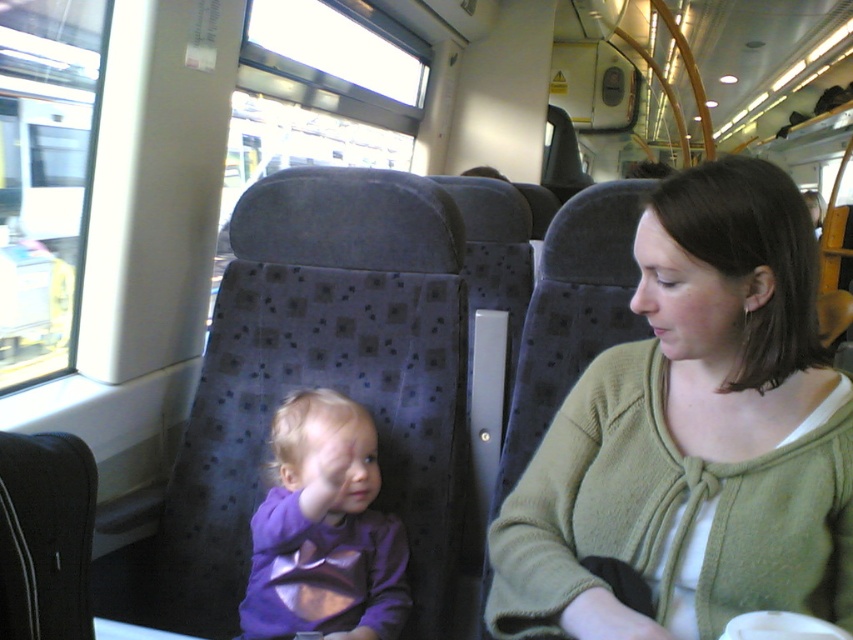
Is point (695, 506) farther from camera compared to point (306, 525)?

No, it is not.

Does point (714, 488) lie in front of point (322, 611)?

Yes.

Where is `green knit cardigan at center`? The width and height of the screenshot is (853, 640). green knit cardigan at center is located at coordinates (693, 435).